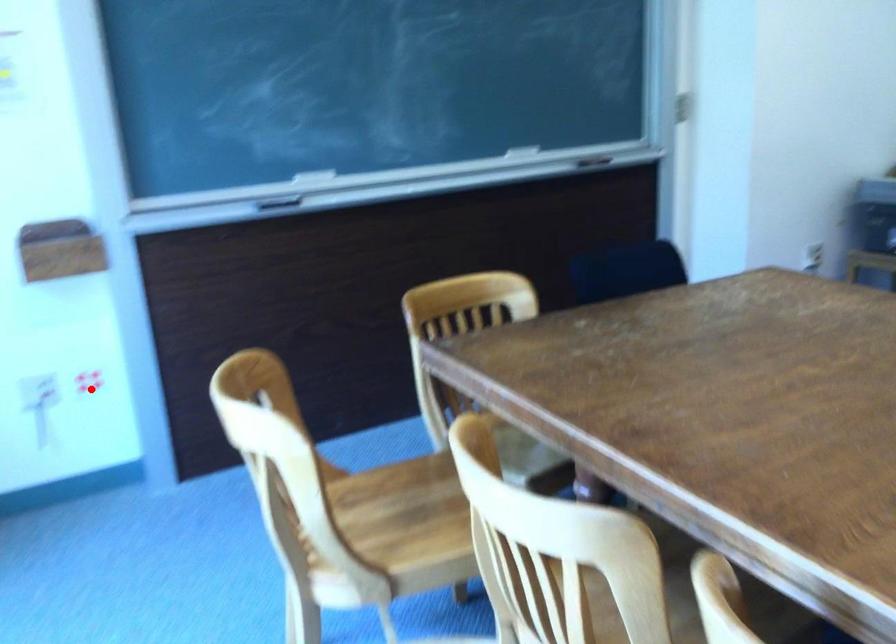
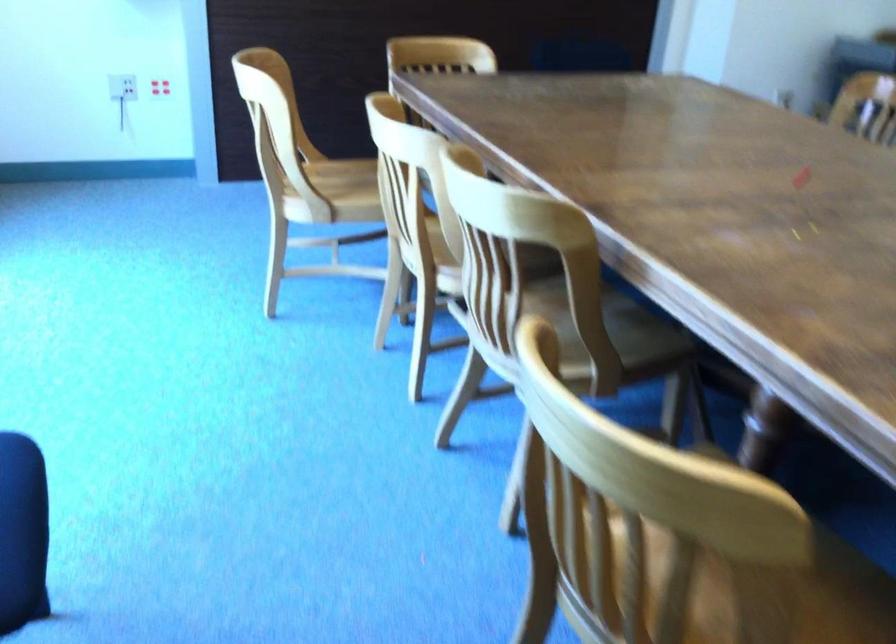
Where in the second image is the point corresponding to the highlighted location from the first image?

(159, 87)